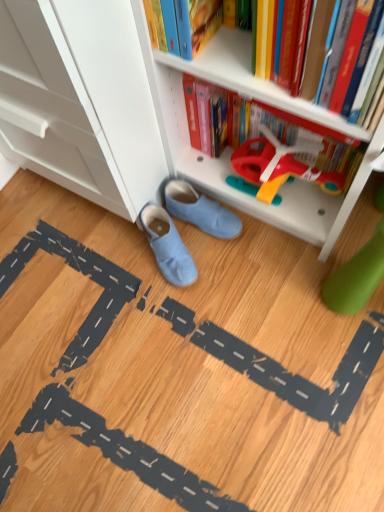
Find the location of `vacant space in between white plastic bookcase at lower center and light blue suede shoes at center, which appears as the second footwear when viewed from the top`. vacant space in between white plastic bookcase at lower center and light blue suede shoes at center, which appears as the second footwear when viewed from the top is located at coordinates (242, 261).